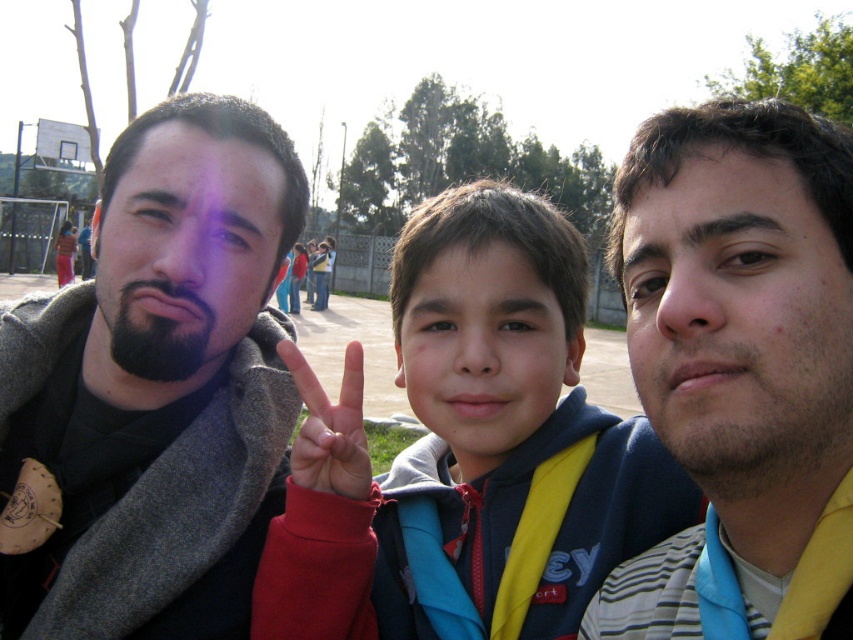
You are a photographer trying to capture a group photo. You notice the smooth skin face at right and the blue fleece jacket at center. Which one is closer to the camera?

The blue fleece jacket at center is closer to the camera than the smooth skin face at right because the smooth skin face at right is behind the blue fleece jacket at center.

You are a photographer trying to adjust the lighting for the photo. You notice the smooth skin face at center and the matte red hand at center. Which object is located to the right of the other?

The smooth skin face at center is positioned on the right side of matte red hand at center.